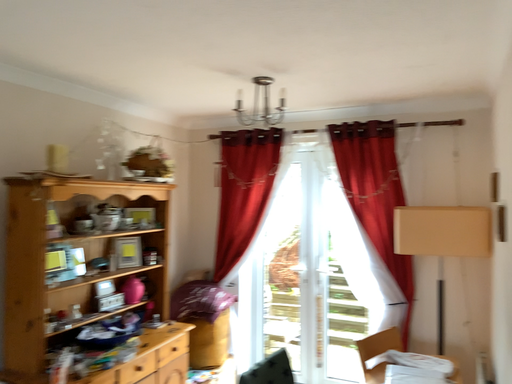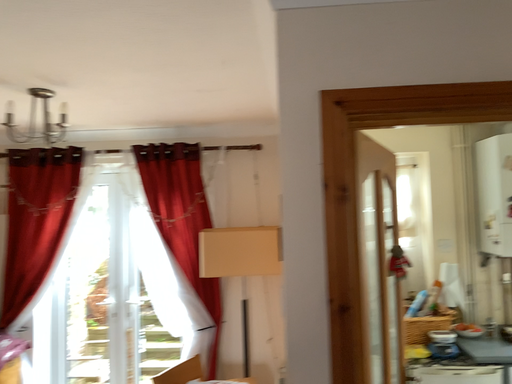
Question: How did the camera likely rotate when shooting the video?

Choices:
 (A) rotated right
 (B) rotated left

Answer: (A)